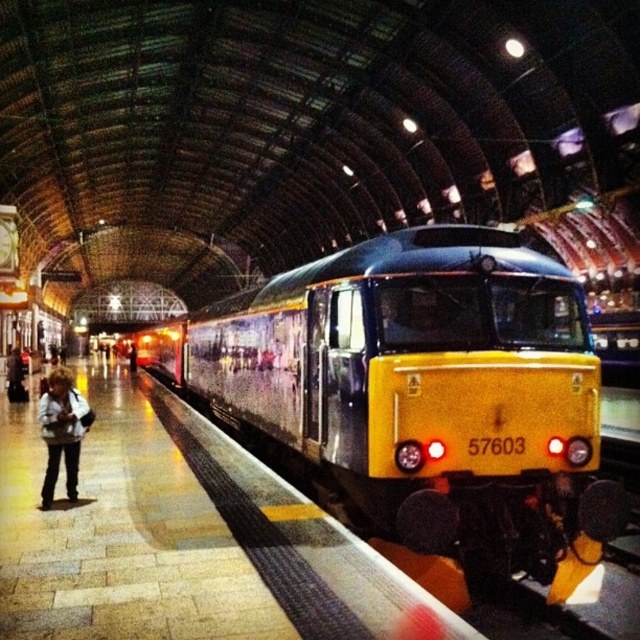
You are standing at the train station and see the light brown leather jacket at lower left. If you want to reach it quickly, how many steps would you estimate to take, assuming each step covers about 0.75 meters?

The light brown leather jacket at lower left is 6.96 meters away. Dividing the distance by the step length of 0.75 meters gives approximately 9.28 steps. Since you can only take whole steps, you would need to take around 9 or 10 steps to reach it.

You are standing at the train station platform and want to reach a specific point marked at coordinates point (486, 333). If you can walk 3 feet per second, how many seconds will it take you to reach that point?

The distance of point (486, 333) from viewer is 20.10 feet. At a walking speed of 3 feet per second, it would take approximately 6.7 seconds to reach the point.

You are a photographer trying to capture the yellow polished metal train at center and the light brown leather jacket at lower left in the same frame. Which object should you focus on first to ensure both are in the frame without moving the camera?

The yellow polished metal train at center is taller than the light brown leather jacket at lower left, so you should focus on the yellow polished metal train at center first to ensure both are in the frame without moving the camera.